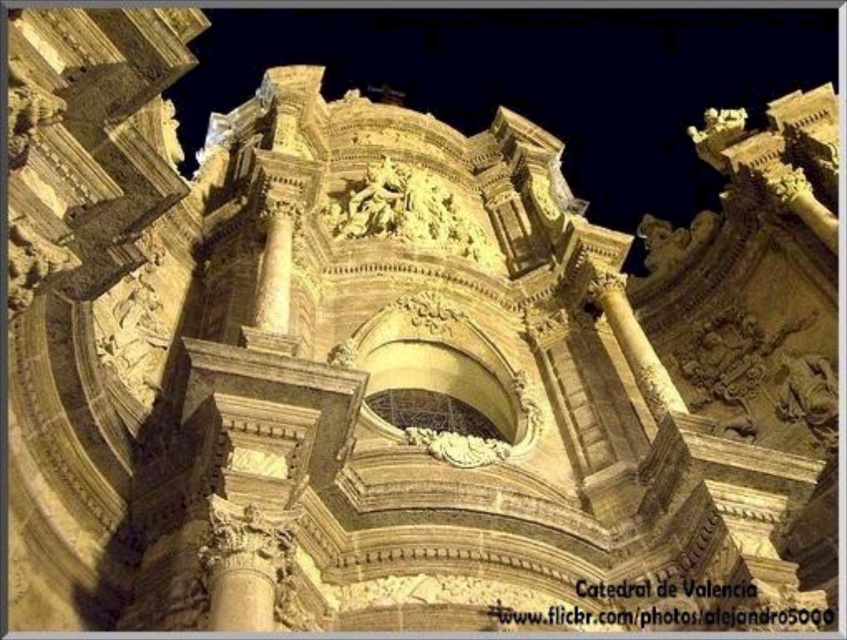
Measure the distance from golden stone sculpture at center to golden stone column at center.

611.31 feet

Is point (300, 8) positioned before point (288, 301)?

No.

Does point (257, 12) lie in front of point (256, 288)?

No, it is not.

The image size is (847, 640). In order to click on golden stone sculpture at center in this screenshot , I will do `click(538, 81)`.